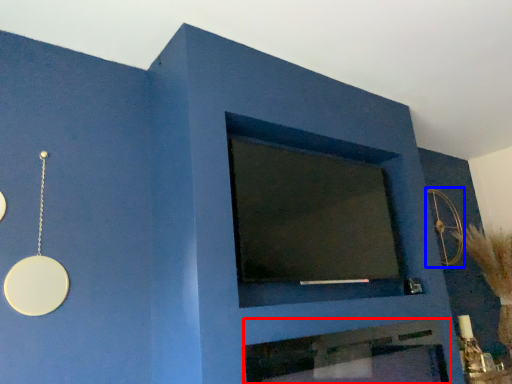
Question: Which object appears farthest to the camera in this image, fireplace (highlighted by a red box) or circle (highlighted by a blue box)?

Choices:
 (A) fireplace
 (B) circle

Answer: (B)